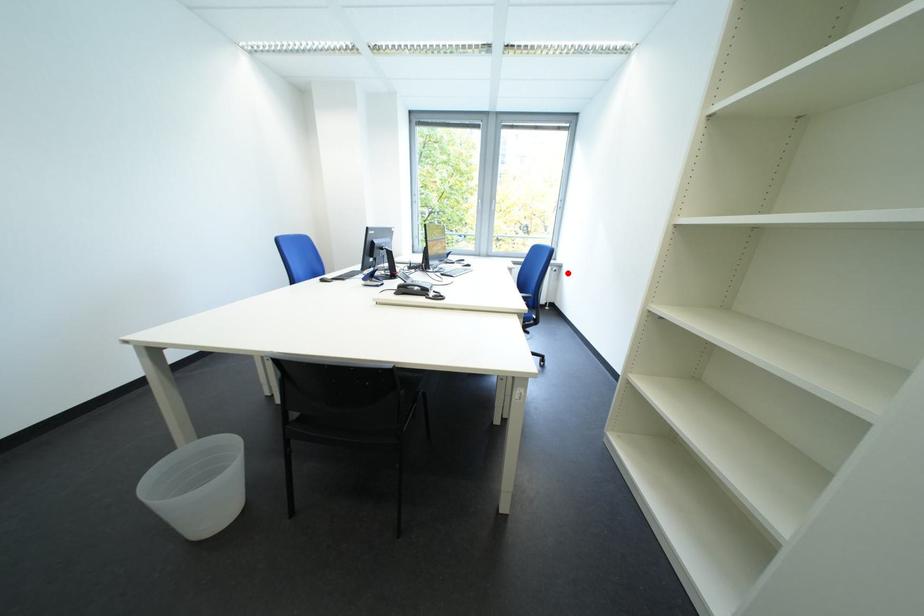
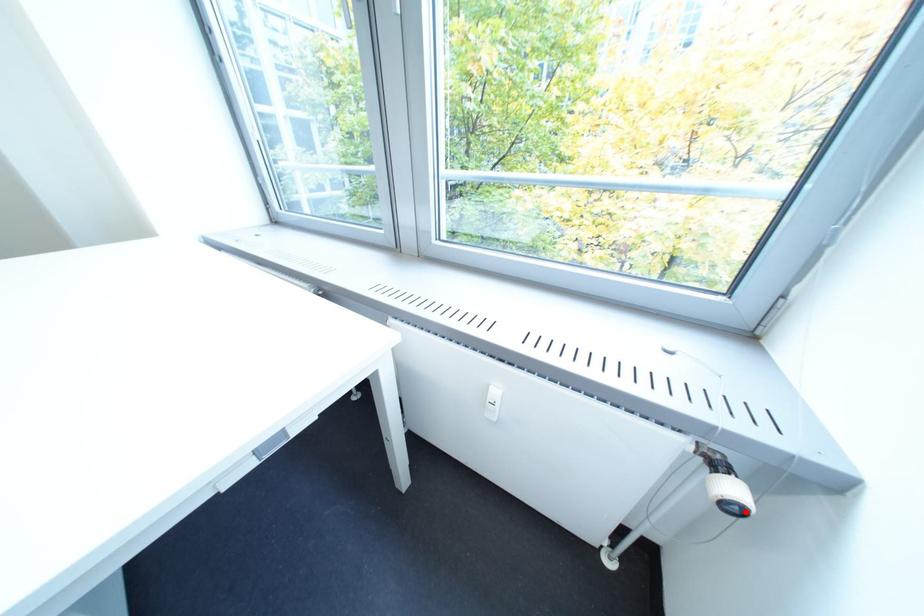
I am providing you with two images of the same scene from different viewpoints. A red point is marked on the first image and another point is marked on the second image. Are the points marked in image1 and image2 representing the same 3D position?

Yes